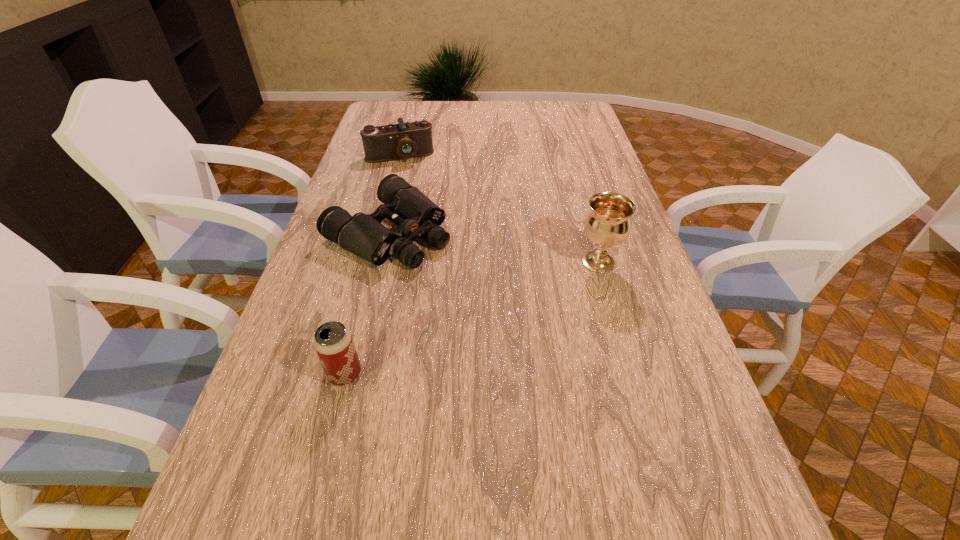
This screenshot has height=540, width=960. Find the location of `free space located on the lens of the camera`. free space located on the lens of the camera is located at coordinates (417, 196).

Find the location of a particular element. The height and width of the screenshot is (540, 960). blank area located on the lens of the camera is located at coordinates (415, 191).

Identify the location of free spot located 0.270m on the lens of the camera. 420,208.

At what (x,y) coordinates should I click in order to perform the action: click on beer can located at the left edge. Please return your answer as a coordinate pair (x, y). Looking at the image, I should click on tap(333, 342).

This screenshot has width=960, height=540. In order to click on binoculars that is at the left edge in this screenshot , I will do `click(416, 215)`.

The width and height of the screenshot is (960, 540). Identify the location of camera that is at the left edge. (391, 142).

Locate an element on the screen. The image size is (960, 540). object positioned at the right edge is located at coordinates (607, 224).

I want to click on free spot at the far edge of the desktop, so click(478, 124).

This screenshot has height=540, width=960. Find the location of `vacant space at the near edge`. vacant space at the near edge is located at coordinates (327, 451).

Locate an element on the screen. vacant space at the left edge of the desktop is located at coordinates (365, 282).